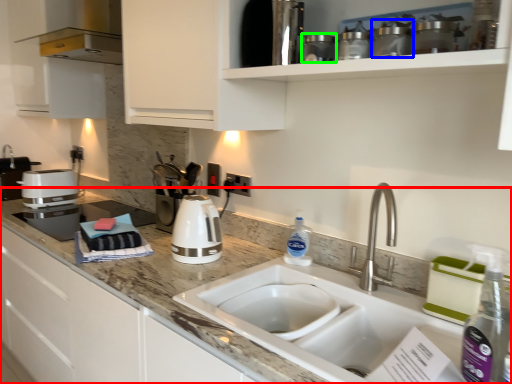
Question: Which object is positioned farthest from countertop (highlighted by a red box)? Select from appliance (highlighted by a blue box) and appliance (highlighted by a green box).

Choices:
 (A) appliance
 (B) appliance

Answer: (A)